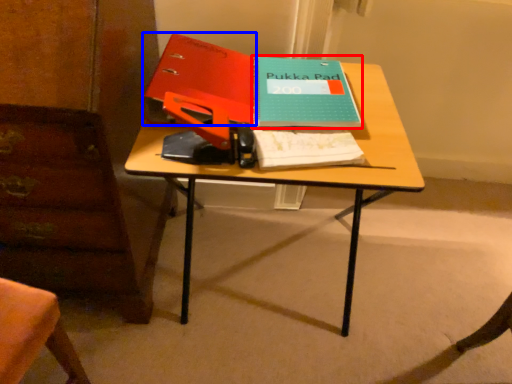
Question: Which object is further to the camera taking this photo, paperback book (highlighted by a red box) or paperback book (highlighted by a blue box)?

Choices:
 (A) paperback book
 (B) paperback book

Answer: (A)